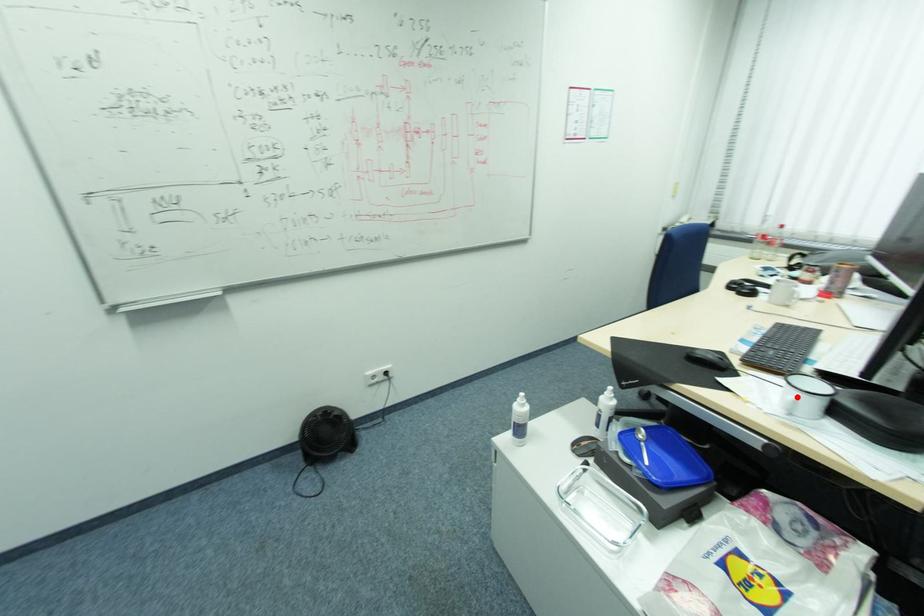
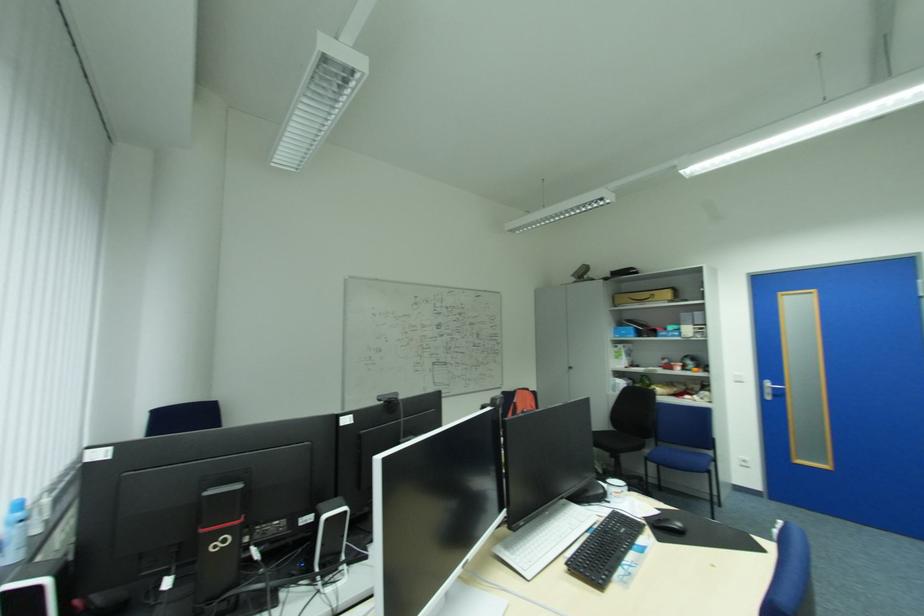
Question: I am providing you with two images of the same scene from different viewpoints. A red point is marked on the first image. At the location where the point appears in image 1, is it still visible in image 2?

Choices:
 (A) Yes
 (B) No

Answer: (B)